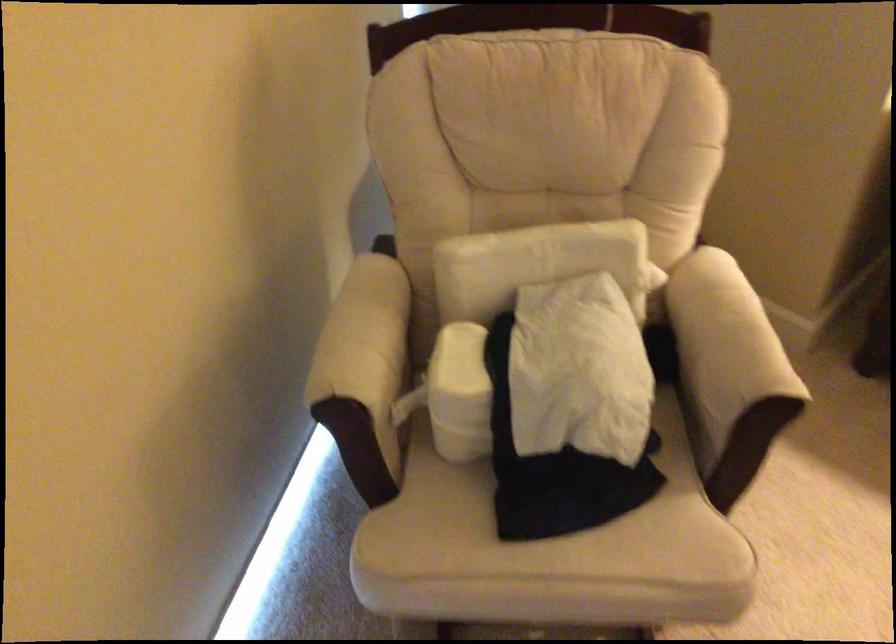
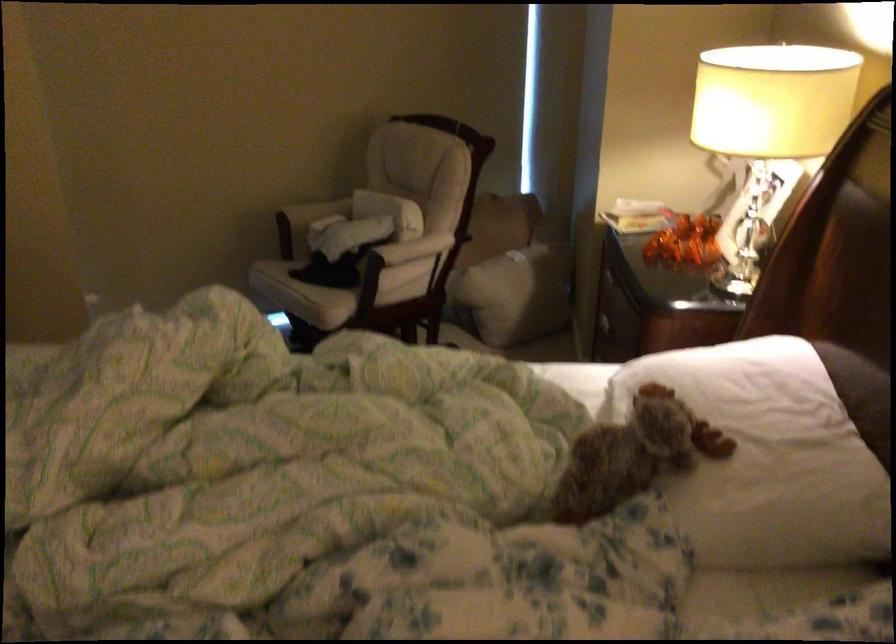
The point at (586,565) is marked in the first image. Where is the corresponding point in the second image?

(291, 285)